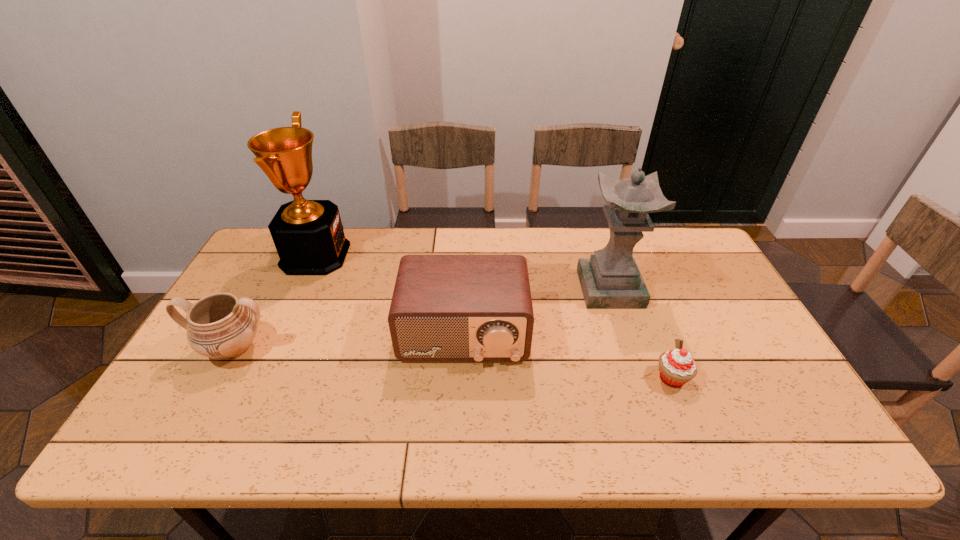
Image resolution: width=960 pixels, height=540 pixels. What are the coordinates of `trophy cup that is at the far edge` in the screenshot? It's located at (308, 235).

You are a GUI agent. You are given a task and a screenshot of the screen. Output one action in this format:
    pyautogui.click(x=<x>, y=<y>)
    Task: Click on the sculpture present at the far edge
    
    Given the screenshot: What is the action you would take?
    pyautogui.click(x=610, y=279)

This screenshot has height=540, width=960. Find the location of `trophy cup situated at the left edge`. trophy cup situated at the left edge is located at coordinates (308, 235).

Locate an element on the screen. urn located at the left edge is located at coordinates (221, 326).

Locate an element on the screen. object at the far left corner is located at coordinates (308, 235).

In the image, there is a desktop. Identify the location of blank space at the far edge. This screenshot has width=960, height=540. (395, 251).

Image resolution: width=960 pixels, height=540 pixels. I want to click on vacant space at the near edge of the desktop, so click(x=351, y=420).

The height and width of the screenshot is (540, 960). Find the location of `free spot at the left edge of the desktop`. free spot at the left edge of the desktop is located at coordinates (263, 279).

Find the location of a particular element. vacant region at the right edge of the desktop is located at coordinates (706, 349).

This screenshot has height=540, width=960. I want to click on vacant space at the far right corner, so click(711, 271).